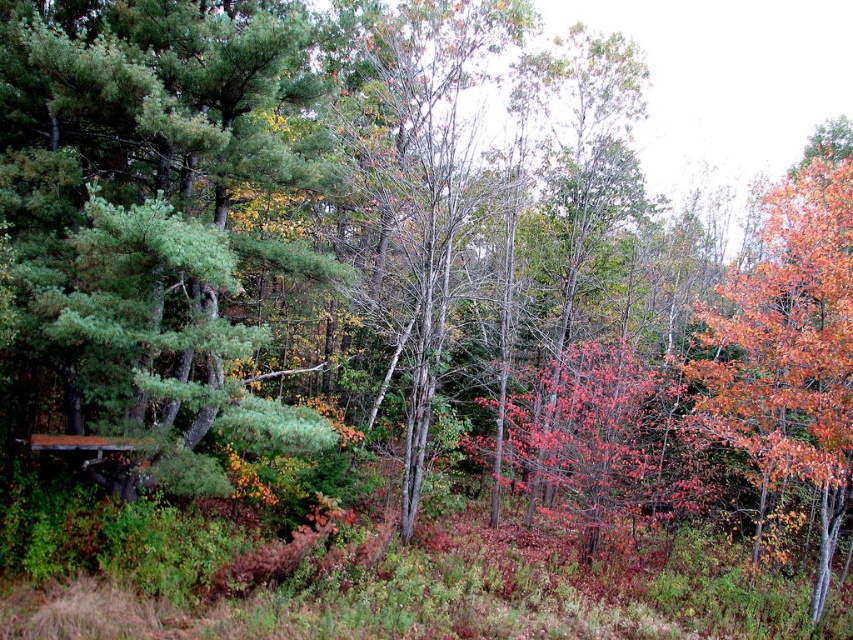
Who is taller, orange-brown bark tree at right or wooden picnic table at lower left?

Standing taller between the two is orange-brown bark tree at right.

Does point (755, 276) come farther from viewer compared to point (39, 435)?

Yes, point (755, 276) is farther from viewer.

What are the coordinates of `orange-brown bark tree at right` in the screenshot? It's located at (790, 349).

Which of these two, smooth bark tree at center or orange-brown bark tree at right, stands shorter?

orange-brown bark tree at right is shorter.

Does smooth bark tree at center appear on the right side of orange-brown bark tree at right?

No, smooth bark tree at center is not to the right of orange-brown bark tree at right.

Does point (358, 132) lie behind point (741, 296)?

Yes, point (358, 132) is farther from viewer.

The height and width of the screenshot is (640, 853). Identify the location of smooth bark tree at center. (421, 180).

Which is behind, point (381, 266) or point (70, 445)?

Positioned behind is point (381, 266).

Is point (474, 145) positioned after point (120, 468)?

Yes, point (474, 145) is behind point (120, 468).

Which is behind, point (416, 250) or point (105, 470)?

Positioned behind is point (416, 250).

The image size is (853, 640). Find the location of `smooth bark tree at center`. smooth bark tree at center is located at coordinates (421, 180).